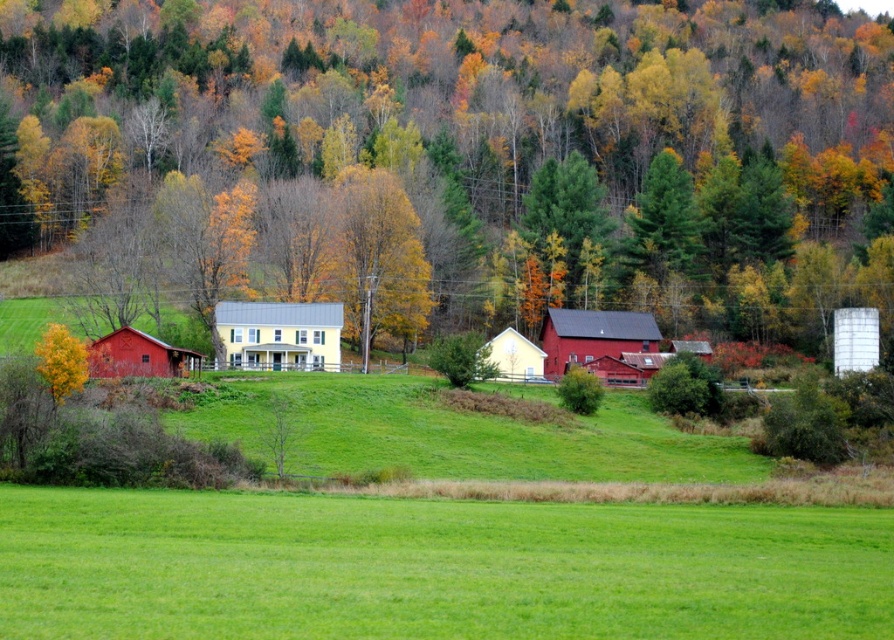
You are a farmer who wants to move a large bale of hay from the yellow matte house at center to the smooth red barn at center. The bale is 1.5 meters wide and 2 meters tall. Can you safely transport it without needing to adjust its size or position?

The distance between the yellow matte house at center and the smooth red barn at center is 16.81 meters. Since the bale of hay is only 1.5 meters wide and 2 meters tall, its dimensions are well within the space available between the two structures. Therefore, you can safely transport the bale without needing to adjust its size or position.